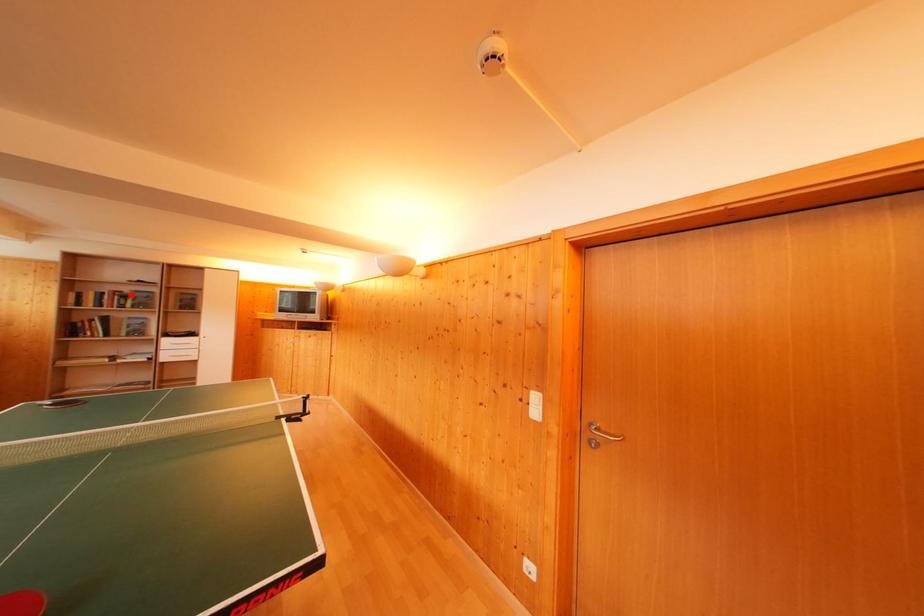
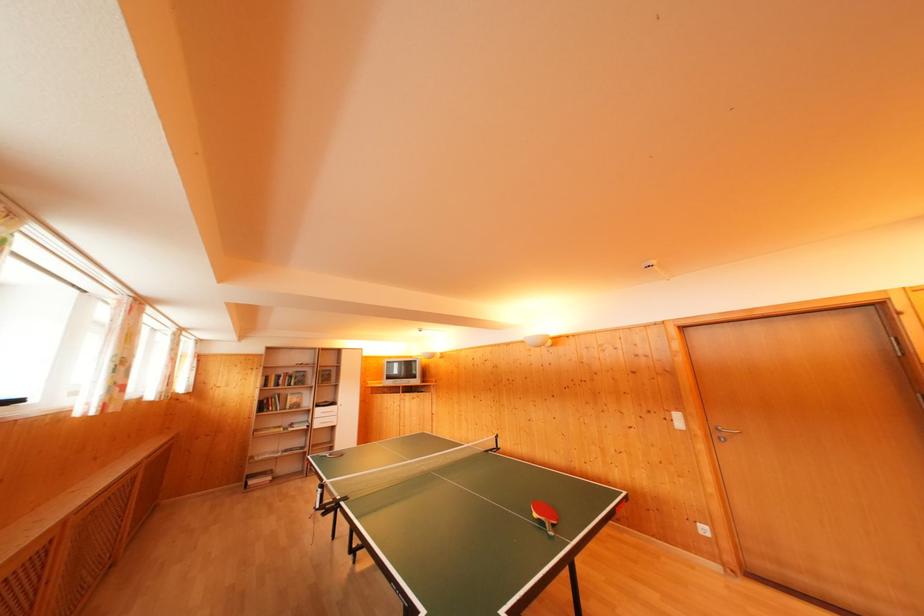
Where in the second image is the point corresponding to the highlighted location from the first image?

(296, 376)